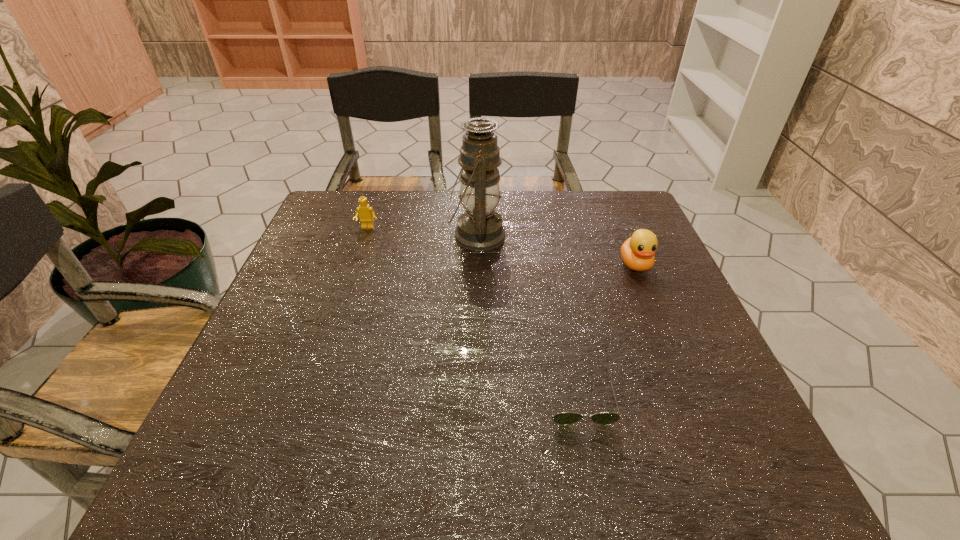
In the image, there is a desktop. Where is `vacant space at the far right corner`? This screenshot has height=540, width=960. vacant space at the far right corner is located at coordinates (619, 202).

This screenshot has width=960, height=540. In order to click on free space between the third object from right to left and the duckling in this screenshot , I will do `click(556, 250)`.

The height and width of the screenshot is (540, 960). In order to click on empty space that is in between the leftmost object and the rightmost object in this screenshot , I will do click(x=501, y=246).

Locate an element on the screen. The width and height of the screenshot is (960, 540). vacant point located between the second object from right to left and the oil lamp is located at coordinates click(x=528, y=316).

Find the location of a particular element. vacant space that is in between the tallest object and the rightmost object is located at coordinates (556, 250).

I want to click on blank region between the rightmost object and the nearest object, so click(608, 331).

Locate an element on the screen. vacant area that lies between the duckling and the tallest object is located at coordinates (556, 250).

The image size is (960, 540). Identify the location of free space between the third object from right to left and the third object from left to right. (528, 316).

At what (x,y) coordinates should I click in order to perform the action: click on free area in between the sunglasses and the rightmost object. Please return your answer as a coordinate pair (x, y). This screenshot has width=960, height=540. Looking at the image, I should click on (608, 331).

This screenshot has width=960, height=540. In order to click on free space that is in between the Lego and the rightmost object in this screenshot , I will do `click(501, 246)`.